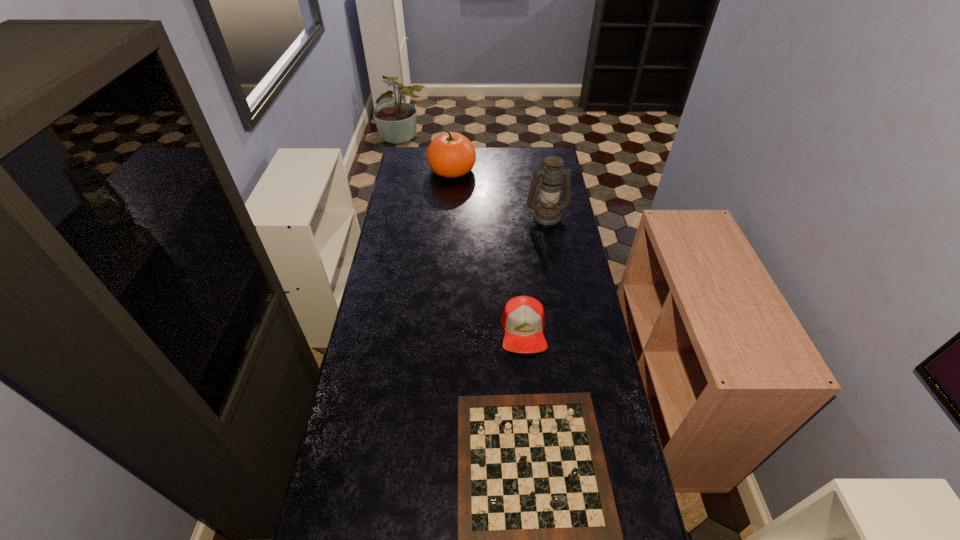
Find the location of a particular element. oil lamp is located at coordinates (547, 212).

You are a GUI agent. You are given a task and a screenshot of the screen. Output one action in this format:
    pyautogui.click(x=<x>, y=<y>)
    Task: Click on the tallest object
    
    Given the screenshot: What is the action you would take?
    pyautogui.click(x=547, y=212)

This screenshot has height=540, width=960. What are the coordinates of `the farthest object` in the screenshot? It's located at (450, 155).

Identify the location of pumpkin. (450, 155).

Locate an element on the screen. the third farthest object is located at coordinates (x=523, y=320).

In order to click on vacant region located 0.100m on the front of the tallest object in this screenshot , I will do `click(551, 240)`.

This screenshot has width=960, height=540. Identify the location of vacant space located 0.230m on the right of the farthest object. (x=519, y=170).

At what (x,y) coordinates should I click in order to perform the action: click on free location located on the front-facing side of the third farthest object. Please return your answer as a coordinate pair (x, y). The image size is (960, 540). Looking at the image, I should click on (535, 461).

Locate an element on the screen. object located in the far edge section of the desktop is located at coordinates (450, 155).

Locate an element on the screen. This screenshot has width=960, height=540. object present at the left edge is located at coordinates (450, 155).